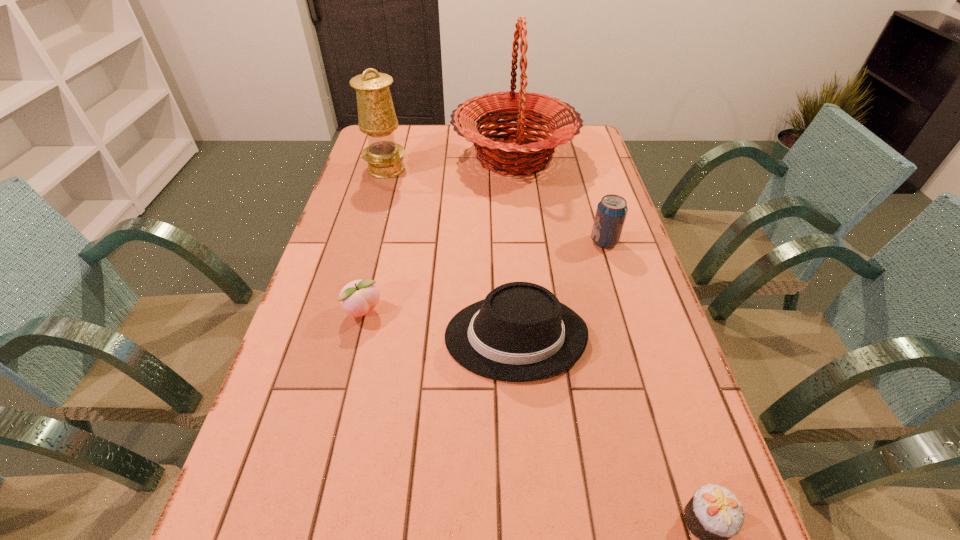
The width and height of the screenshot is (960, 540). What are the coordinates of `free space in the image that satisfies the following two spatial constraints: 1. on the back side of the basket; 2. on the left side of the fifth shortest object` in the screenshot? It's located at (390, 157).